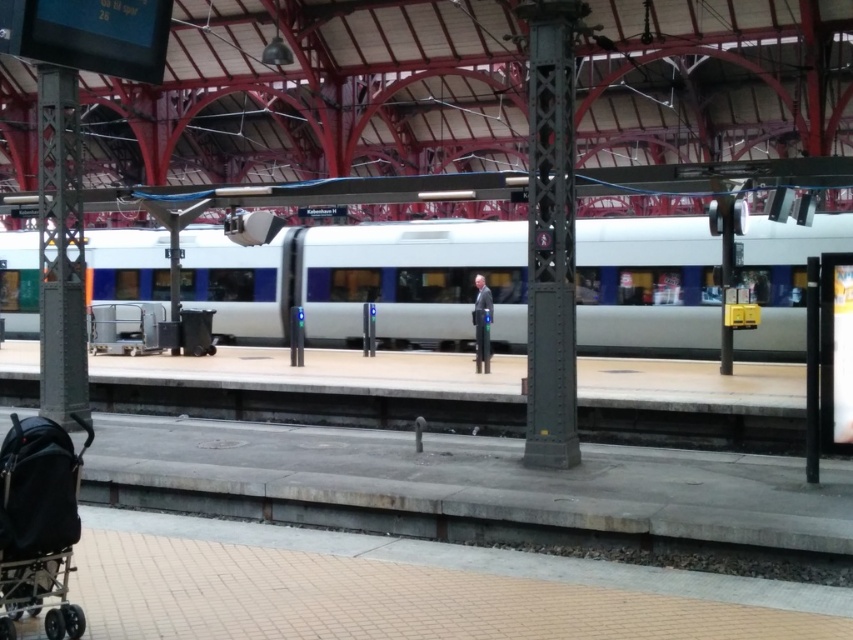
Which is more to the right, silver metallic train at center or black fabric baby carriage at lower left?

black fabric baby carriage at lower left is more to the right.

Between silver metallic train at center and black fabric baby carriage at lower left, which one has less height?

black fabric baby carriage at lower left is shorter.

Who is more distant from viewer, (752, 218) or (61, 547)?

Point (752, 218)

What are the coordinates of `silver metallic train at center` in the screenshot? It's located at (363, 282).

Find the location of `silver metallic train at center`. silver metallic train at center is located at coordinates (363, 282).

Who is positioned more to the left, silver metallic train at center or light blue fabric jacket at center?

silver metallic train at center

Image resolution: width=853 pixels, height=640 pixels. I want to click on silver metallic train at center, so click(x=363, y=282).

Between point (73, 512) and point (486, 323), which one is positioned behind?

The point (486, 323) is more distant.

Describe the element at coordinates (38, 522) in the screenshot. Image resolution: width=853 pixels, height=640 pixels. I see `black fabric baby carriage at lower left` at that location.

Is point (71, 484) more distant than point (477, 336)?

No, it is not.

Locate an element on the screen. black fabric baby carriage at lower left is located at coordinates (38, 522).